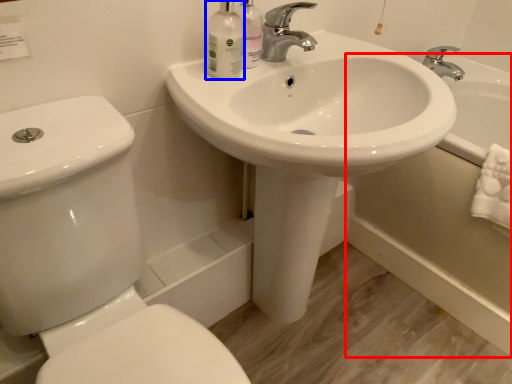
Question: Which point is closer to the camera, bath (highlighted by a red box) or mouthwash (highlighted by a blue box)?

Choices:
 (A) bath
 (B) mouthwash

Answer: (B)